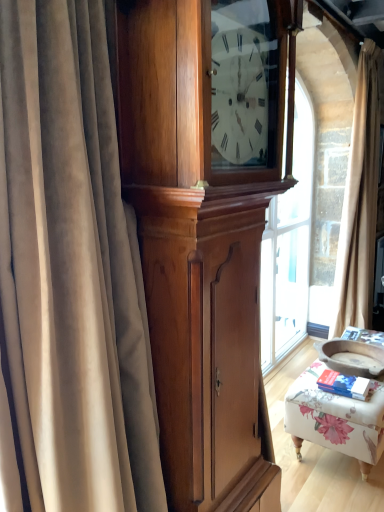
Question: Should I look upward or downward to see floral fabric ottoman at lower right?

Choices:
 (A) down
 (B) up

Answer: (A)

Question: Considering the relative sizes of beige velvet curtain at right, the 2th curtain positioned from the front, and floral fabric ottoman at lower right in the image provided, is beige velvet curtain at right, the 2th curtain positioned from the front, wider than floral fabric ottoman at lower right?

Choices:
 (A) yes
 (B) no

Answer: (B)

Question: Is there a large distance between beige velvet curtain at right, the 2th curtain positioned from the front, and floral fabric ottoman at lower right?

Choices:
 (A) no
 (B) yes

Answer: (B)

Question: Does beige velvet curtain at right, marked as the 1th curtain in a back-to-front arrangement, have a greater height compared to floral fabric ottoman at lower right?

Choices:
 (A) yes
 (B) no

Answer: (A)

Question: Does beige velvet curtain at right, the 2th curtain positioned from the front, appear on the left side of floral fabric ottoman at lower right?

Choices:
 (A) no
 (B) yes

Answer: (A)

Question: Is beige velvet curtain at right, the 2th curtain positioned from the front, bigger than floral fabric ottoman at lower right?

Choices:
 (A) no
 (B) yes

Answer: (B)

Question: Is beige velvet curtain at right, marked as the 1th curtain in a right-to-left arrangement, turned away from floral fabric ottoman at lower right?

Choices:
 (A) yes
 (B) no

Answer: (B)

Question: Considering the relative sizes of polished wood cabinet at center and floral fabric ottoman at lower right in the image provided, is polished wood cabinet at center smaller than floral fabric ottoman at lower right?

Choices:
 (A) yes
 (B) no

Answer: (B)

Question: From the image's perspective, does polished wood cabinet at center appear higher than floral fabric ottoman at lower right?

Choices:
 (A) no
 (B) yes

Answer: (B)

Question: Does polished wood cabinet at center have a lesser height compared to floral fabric ottoman at lower right?

Choices:
 (A) no
 (B) yes

Answer: (A)

Question: From the image's perspective, is polished wood cabinet at center beneath floral fabric ottoman at lower right?

Choices:
 (A) yes
 (B) no

Answer: (B)

Question: Is polished wood cabinet at center taller than floral fabric ottoman at lower right?

Choices:
 (A) no
 (B) yes

Answer: (B)

Question: Does polished wood cabinet at center touch floral fabric ottoman at lower right?

Choices:
 (A) yes
 (B) no

Answer: (B)

Question: From a real-world perspective, does polished wood cabinet at center stand above velvet curtain at left, arranged as the first curtain when viewed from the left?

Choices:
 (A) yes
 (B) no

Answer: (B)